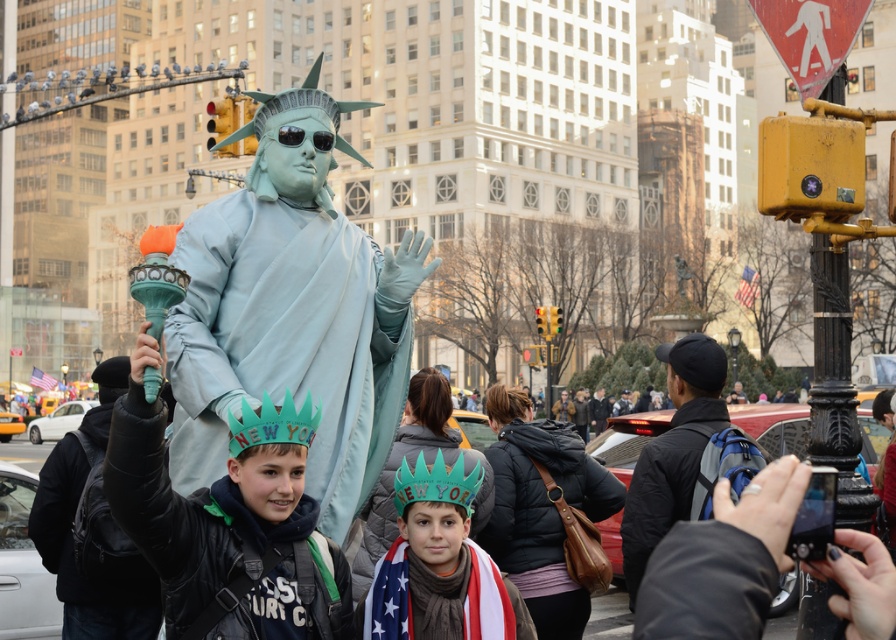
Question: Among these objects, which one is nearest to the camera?

Choices:
 (A) green paper crown at center
 (B) matte blue statue at center

Answer: (A)

Question: Considering the real-world distances, which object is closest to the green felt crown at center?

Choices:
 (A) green paper crown at center
 (B) matte blue statue at center

Answer: (A)

Question: Does matte blue statue at center appear on the left side of leather brown purse at center?

Choices:
 (A) no
 (B) yes

Answer: (B)

Question: Is matte blue statue at center to the left of green felt crown at center from the viewer's perspective?

Choices:
 (A) yes
 (B) no

Answer: (A)

Question: Which of these objects is positioned farthest from the green felt crown at center?

Choices:
 (A) leather brown purse at center
 (B) matte blue statue at center
 (C) green paper crown at center

Answer: (A)

Question: Does matte blue statue at center have a larger size compared to green paper crown at center?

Choices:
 (A) no
 (B) yes

Answer: (B)